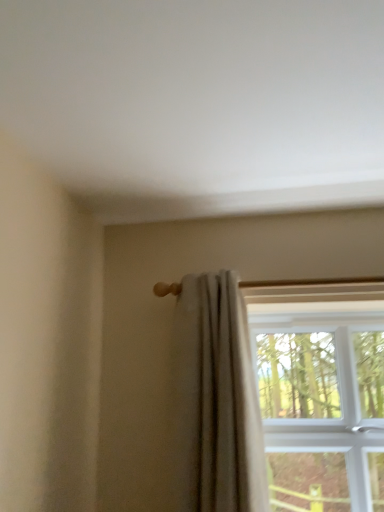
Question: Could you tell me if light beige fabric curtain at center is turned towards clear glass window at upper right?

Choices:
 (A) no
 (B) yes

Answer: (A)

Question: From the image's perspective, is light beige fabric curtain at center located beneath clear glass window at upper right?

Choices:
 (A) no
 (B) yes

Answer: (A)

Question: Is light beige fabric curtain at center further to camera compared to clear glass window at upper right?

Choices:
 (A) no
 (B) yes

Answer: (A)

Question: Can you confirm if light beige fabric curtain at center is taller than clear glass window at upper right?

Choices:
 (A) yes
 (B) no

Answer: (A)

Question: Considering the relative sizes of light beige fabric curtain at center and clear glass window at upper right in the image provided, is light beige fabric curtain at center bigger than clear glass window at upper right?

Choices:
 (A) no
 (B) yes

Answer: (A)

Question: Is light beige fabric curtain at center far away from clear glass window at upper right?

Choices:
 (A) no
 (B) yes

Answer: (A)

Question: Considering the relative positions of clear glass window at upper right and light beige fabric curtain at center in the image provided, is clear glass window at upper right to the left of light beige fabric curtain at center from the viewer's perspective?

Choices:
 (A) no
 (B) yes

Answer: (A)

Question: From the image's perspective, is clear glass window at upper right located above light beige fabric curtain at center?

Choices:
 (A) yes
 (B) no

Answer: (B)

Question: From the image's perspective, does clear glass window at upper right appear lower than light beige fabric curtain at center?

Choices:
 (A) no
 (B) yes

Answer: (B)

Question: Is clear glass window at upper right oriented away from light beige fabric curtain at center?

Choices:
 (A) yes
 (B) no

Answer: (B)

Question: Does clear glass window at upper right have a larger size compared to light beige fabric curtain at center?

Choices:
 (A) no
 (B) yes

Answer: (B)

Question: Can you confirm if clear glass window at upper right is taller than light beige fabric curtain at center?

Choices:
 (A) yes
 (B) no

Answer: (B)

Question: Considering the relative positions of clear glass window at upper right and light beige fabric curtain at center in the image provided, is clear glass window at upper right to the left or to the right of light beige fabric curtain at center?

Choices:
 (A) right
 (B) left

Answer: (A)